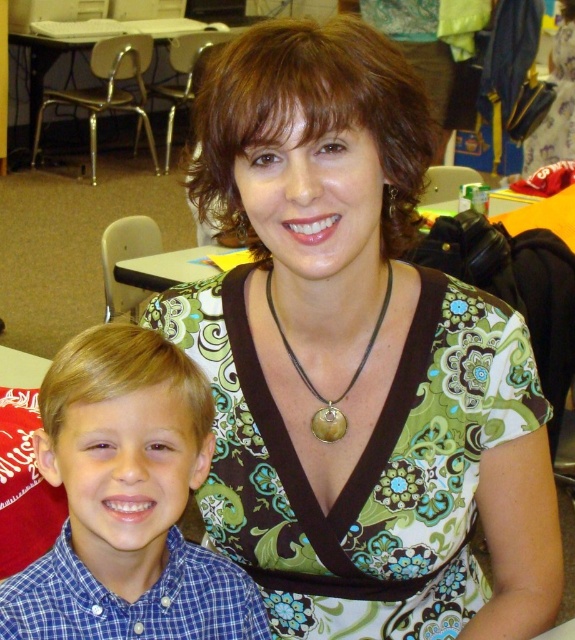
Between blue checkered shirt at lower left and green floral dress at center, which one has less height?

With less height is blue checkered shirt at lower left.

Locate an element on the screen. Image resolution: width=575 pixels, height=640 pixels. blue checkered shirt at lower left is located at coordinates (126, 500).

Is green patterned blouse at center thinner than green floral dress at center?

In fact, green patterned blouse at center might be wider than green floral dress at center.

From the picture: Who is positioned more to the left, green patterned blouse at center or green floral dress at center?

Positioned to the left is green patterned blouse at center.

Locate an element on the screen. The height and width of the screenshot is (640, 575). green patterned blouse at center is located at coordinates (356, 362).

Between green patterned blouse at center and metallic silver table at upper left, which one has less height?

With less height is green patterned blouse at center.

Is point (329, 307) more distant than point (53, 81)?

No, it is in front of (53, 81).

I want to click on green patterned blouse at center, so click(x=356, y=362).